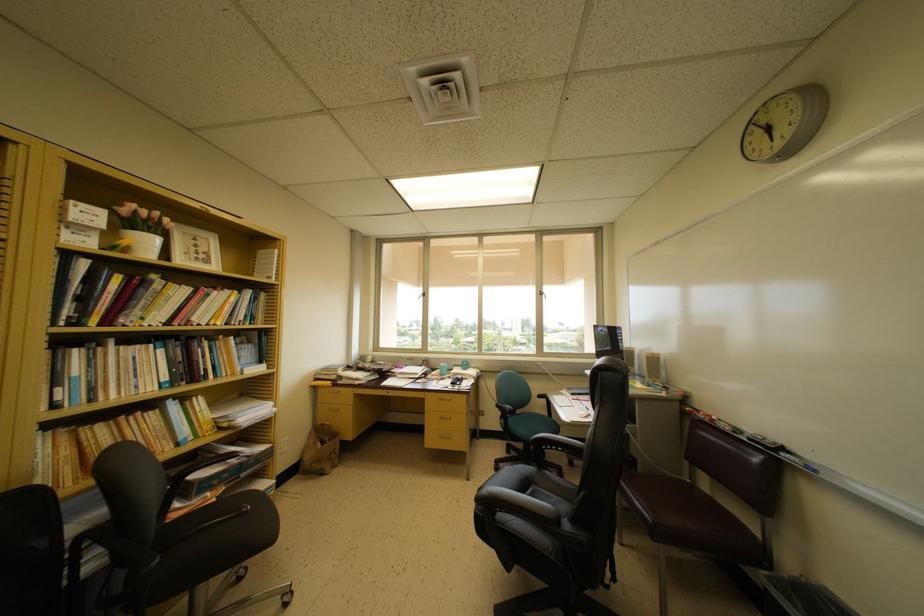
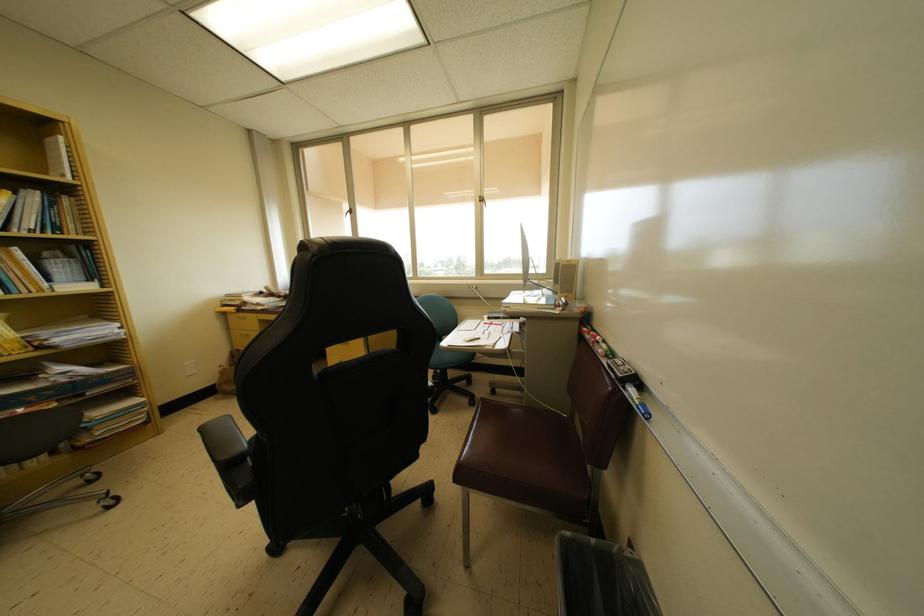
Locate, in the second image, the point that corresponds to (x=657, y=360) in the first image.

(572, 265)